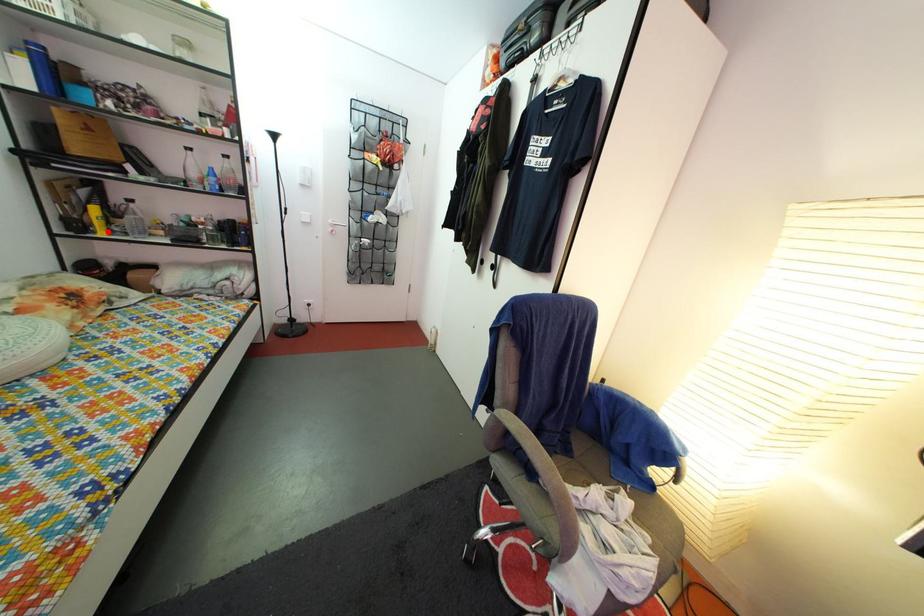
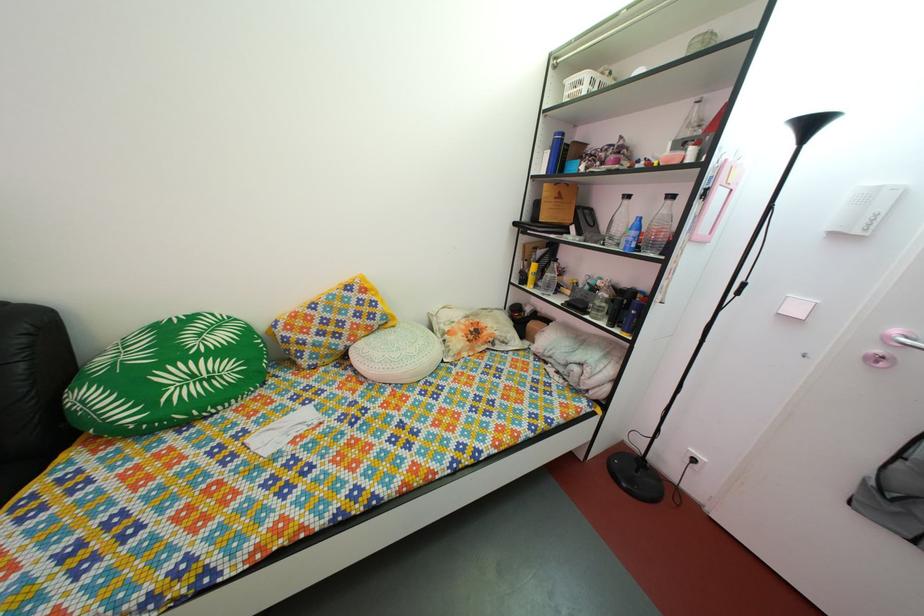
The point at the highlighted location is marked in the first image. Where is the corresponding point in the second image?

(540, 286)